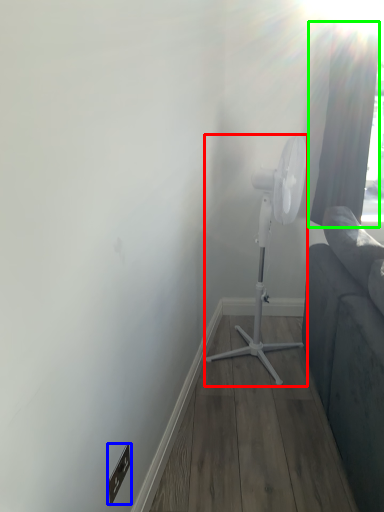
Question: Estimate the real-world distances between objects in this image. Which object is farther from mechanical fan (highlighted by a red box), electric outlet (highlighted by a blue box) or curtain (highlighted by a green box)?

Choices:
 (A) electric outlet
 (B) curtain

Answer: (A)